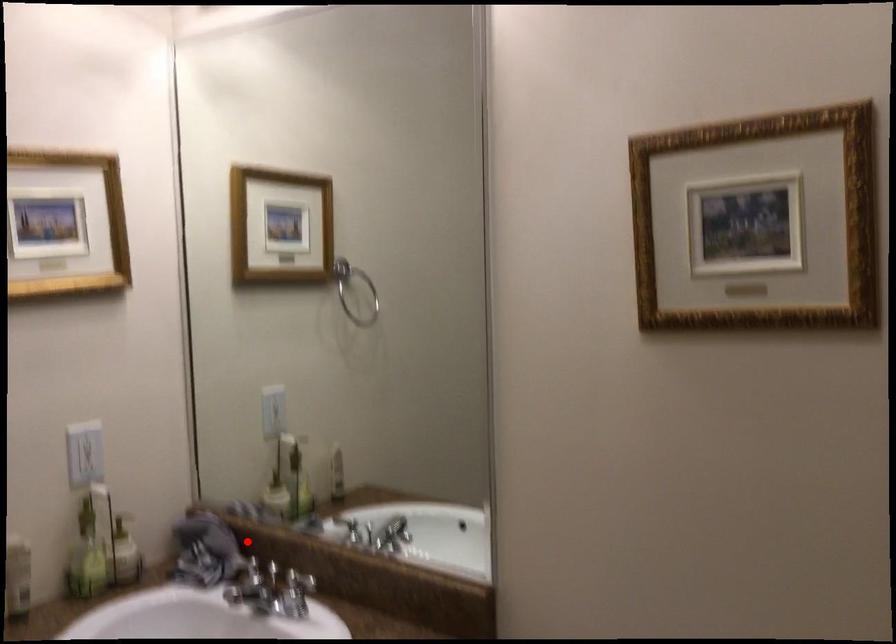
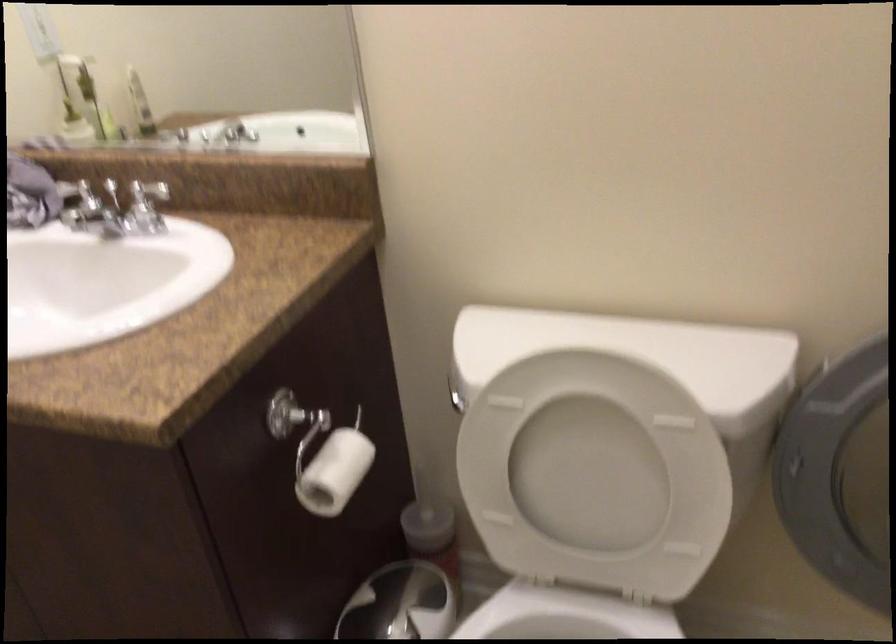
Find the pixel in the second image that matches the highlighted location in the first image.

(64, 180)